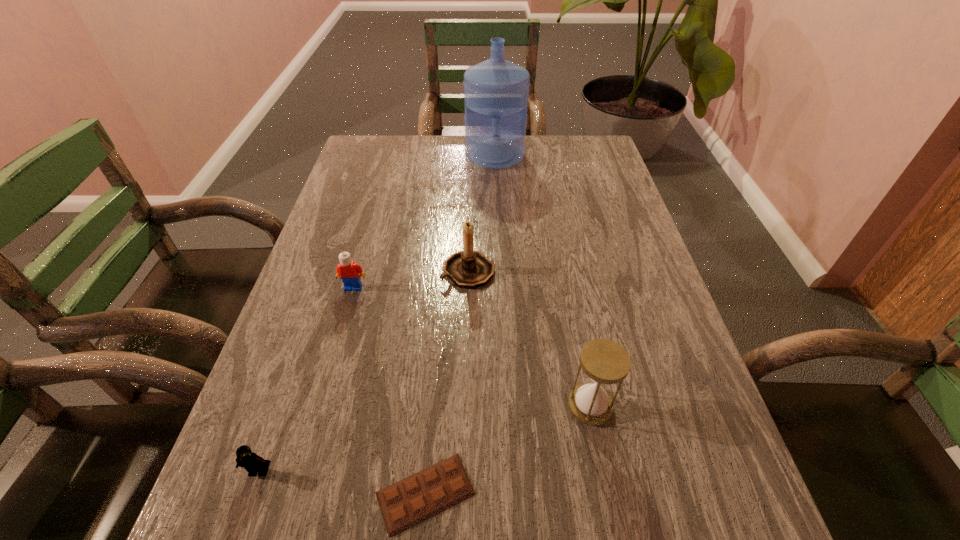
Where is `vacant area situated 0.120m on the side of the water jug with the handle`? This screenshot has height=540, width=960. vacant area situated 0.120m on the side of the water jug with the handle is located at coordinates point(496,192).

This screenshot has height=540, width=960. I want to click on vacant area situated on the front of the candle holder, so click(467, 341).

Identify the location of blank space located 0.110m on the right of the fourth farthest object. (669, 406).

I want to click on vacant point located 0.140m on the face of the farther Lego, so click(x=339, y=339).

What are the coordinates of `free space located 0.050m on the face of the leftmost object` in the screenshot? It's located at (246, 509).

At what (x,y) coordinates should I click in order to perform the action: click on free space located 0.310m on the back of the chocolate bar. Please return your answer as a coordinate pair (x, y). This screenshot has height=540, width=960. Looking at the image, I should click on (440, 317).

Find the location of a particular element. This screenshot has height=540, width=960. object present at the far edge is located at coordinates (496, 91).

Identify the location of object that is at the near edge. (413, 499).

Where is `vacant space at the far edge`? This screenshot has width=960, height=540. vacant space at the far edge is located at coordinates (416, 139).

You are a GUI agent. You are given a task and a screenshot of the screen. Output one action in this format:
    pyautogui.click(x=<x>, y=<y>)
    Task: Click on the free location at the left edge of the desktop
    The width and height of the screenshot is (960, 540).
    Given the screenshot: What is the action you would take?
    pyautogui.click(x=378, y=194)